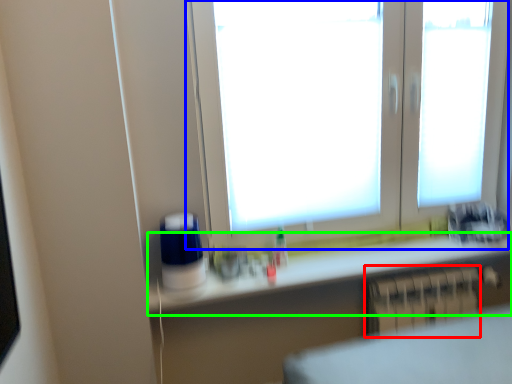
Question: Which is farther away from radiator (highlighted by a red box)? window (highlighted by a blue box) or counter top (highlighted by a green box)?

Choices:
 (A) window
 (B) counter top

Answer: (A)